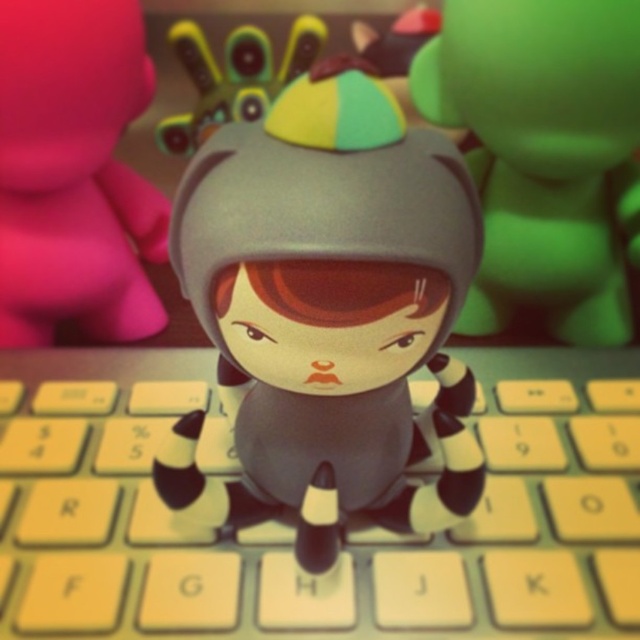
You are setting up a desk and need to place both the yellow plastic keyboard at center and the matte gray helmet at center on the same shelf. The shelf has a maximum width capacity of 1 meter. If the keyboard is wider than the helmet, will both items fit side by side on the shelf without exceeding the width limit?

The yellow plastic keyboard at center is wider than the matte gray helmet at center. However, since the shelf has a maximum width capacity of 1 meter, and we don not have specific measurements for each item, it is impossible to determine if both will fit without additional information about their individual widths.

You are organizing a desk and see the yellow plastic keyboard at center and the matte pink toy at upper left. Which object is positioned lower on the desk?

The yellow plastic keyboard at center is located below the matte pink toy at upper left, so it is positioned lower on the desk.

You are a photographer standing at a certain distance from the yellow plastic keyboard at center. You want to take a closeup shot of the keyboard. Do you need to move closer or farther away?

The yellow plastic keyboard at center is 62.84 centimeters away from the camera. To take a closeup shot, you would need to move closer to the keyboard.